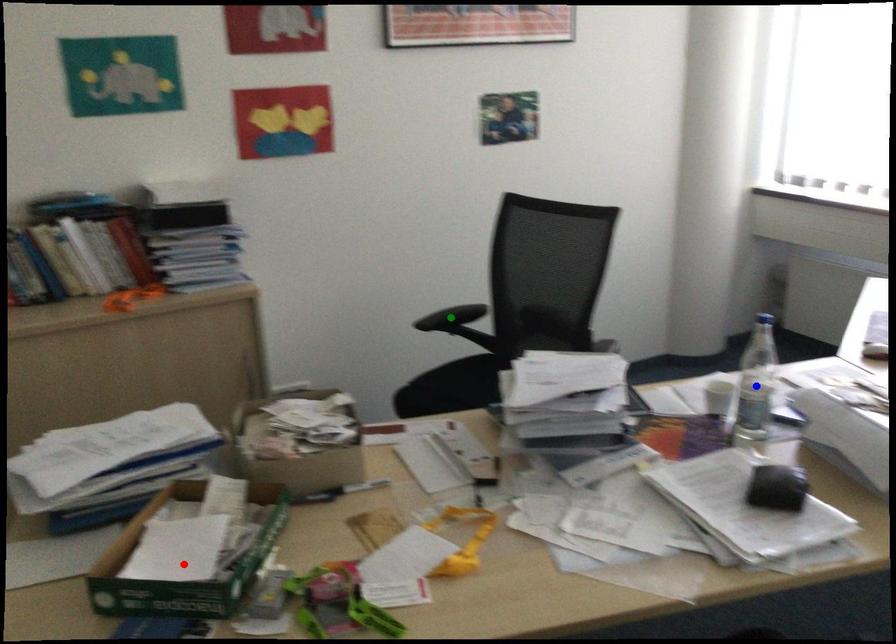
Order these from nearest to farthest:
- blue point
- red point
- green point

red point, blue point, green point